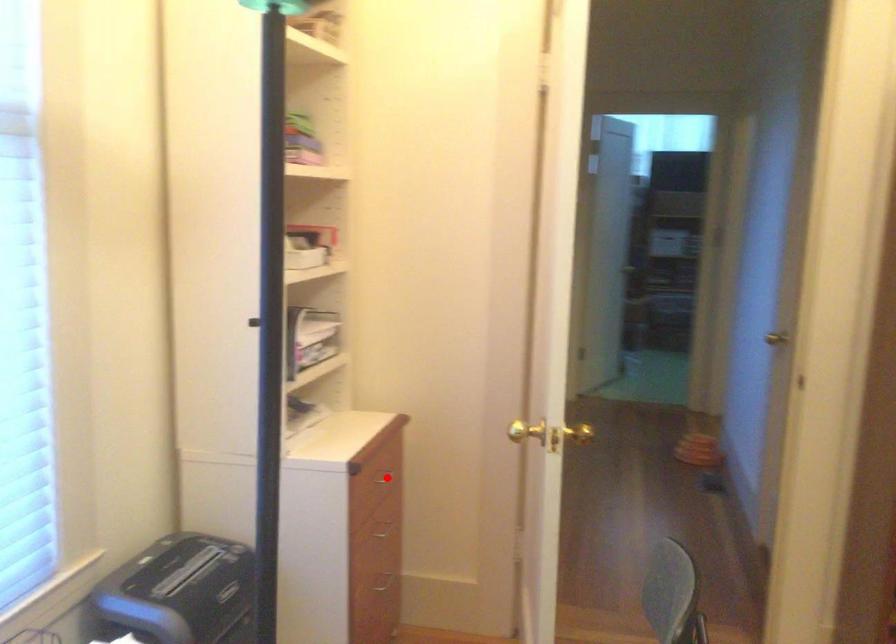
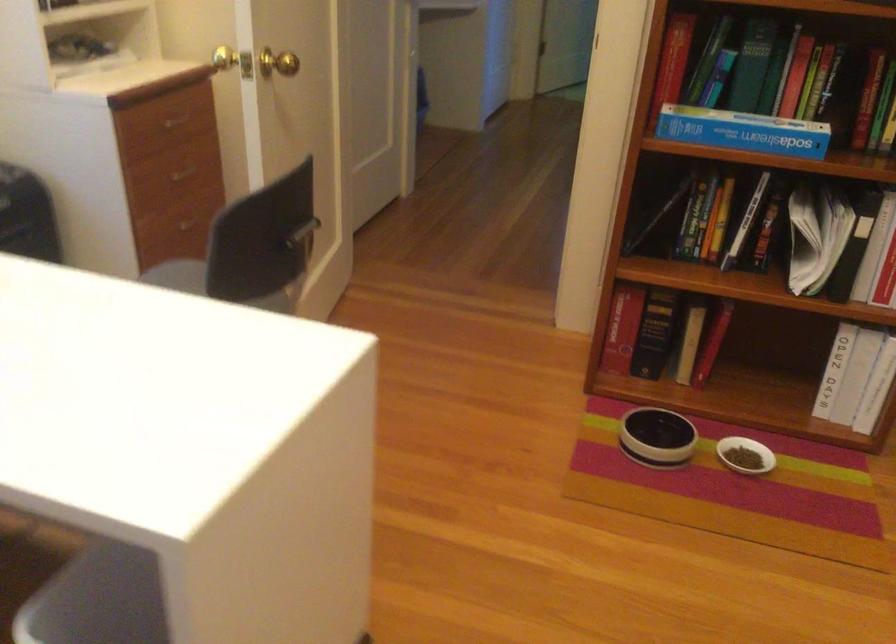
Question: I am providing you with two images of the same scene from different viewpoints. A red point is marked on the first image. Is the red point's position out of view in image 2?

Choices:
 (A) Yes
 (B) No

Answer: (B)